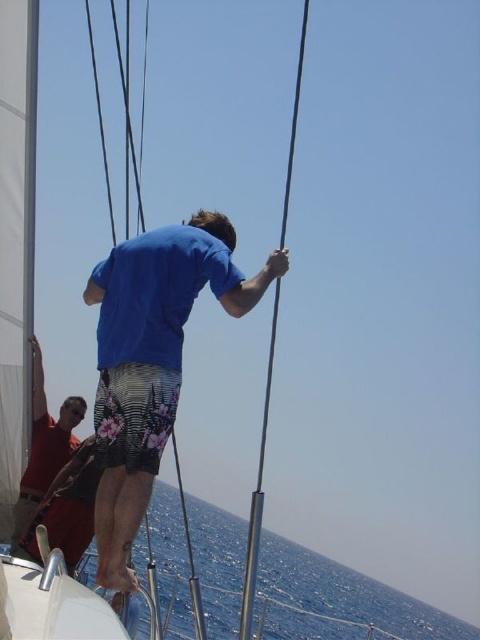
You are a sailor on the deck of the sailboat and need to secure a rope to a specific point. The coordinates given are point [152,360]. What object is located at this point?

The point [152,360] corresponds to the blue fabric shirt at center.

Based on the photo, you are a sailor trying to secure a rope on the deck. You notice the blue fabric shirt at center and the blue water at lower left. Which object is wider in the image?

The blue water at lower left is wider than the blue fabric shirt at center.

You are navigating a sailboat and need to secure a rope between two points. You have two points marked on the deck as point 1 at coordinates point [235,554] and point 2 at coordinates point [252,604]. Which point is closer to the stern of the boat?

Point 1 at coordinates point [235,554] is behind point 2 at coordinates point [252,604], so point 1 is closer to the stern of the boat.